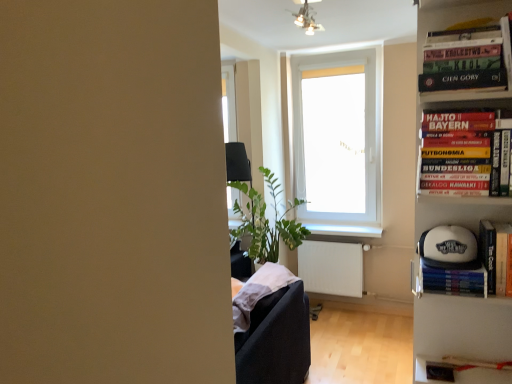
Where is `vacant region above white matte baseball cap at right (from a real-world perspective)`? vacant region above white matte baseball cap at right (from a real-world perspective) is located at coordinates (451, 264).